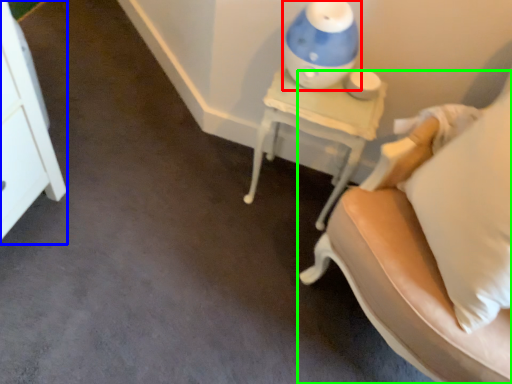
Question: Considering the real-world distances, which object is closest to table lamp (highlighted by a red box)? dresser (highlighted by a blue box) or furniture (highlighted by a green box).

Choices:
 (A) dresser
 (B) furniture

Answer: (B)